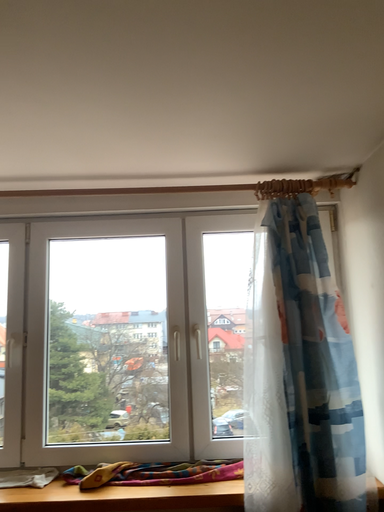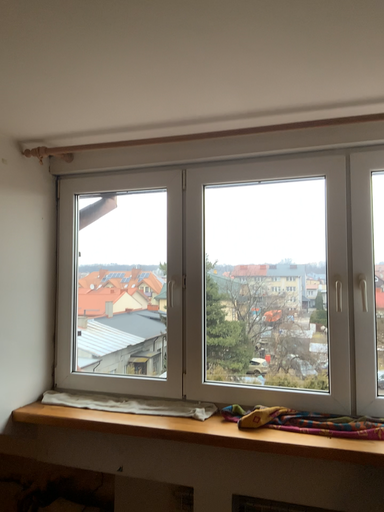
Question: Which way did the camera rotate in the video?

Choices:
 (A) rotated right
 (B) rotated left

Answer: (B)